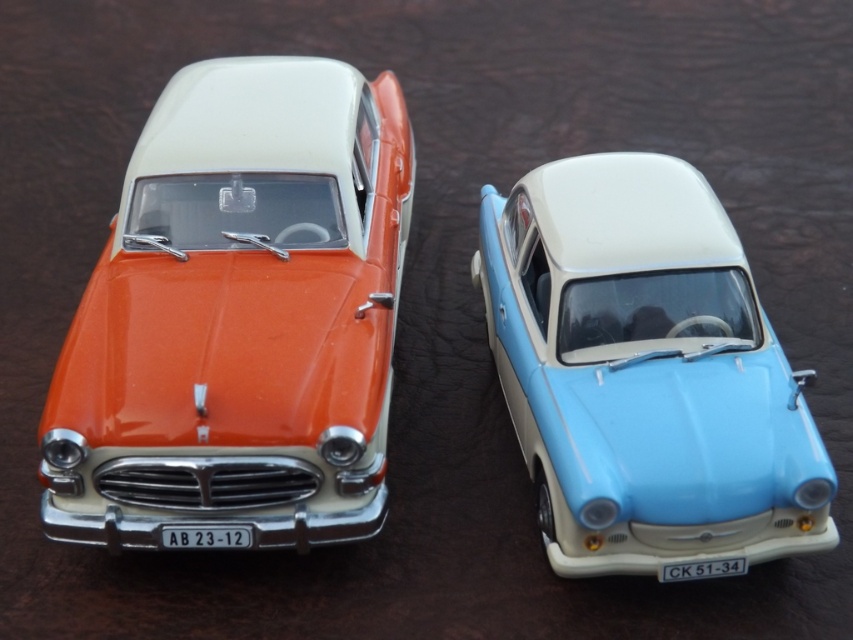
The image size is (853, 640). I want to click on orange glossy car at left, so click(x=238, y=317).

Between orange glossy car at left and light blue plastic car at center, which one has less height?

Standing shorter between the two is light blue plastic car at center.

Is point (160, 237) positioned after point (558, 196)?

Yes, point (160, 237) is farther from viewer.

Find the location of a particular element. Image resolution: width=853 pixels, height=640 pixels. orange glossy car at left is located at coordinates (238, 317).